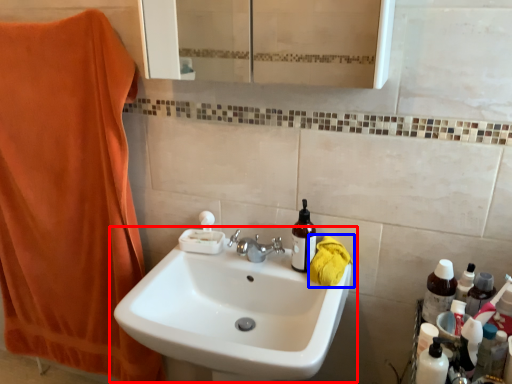
Question: Which of the following is the farthest to the observer, sink (highlighted by a red box) or beach towel (highlighted by a blue box)?

Choices:
 (A) sink
 (B) beach towel

Answer: (B)